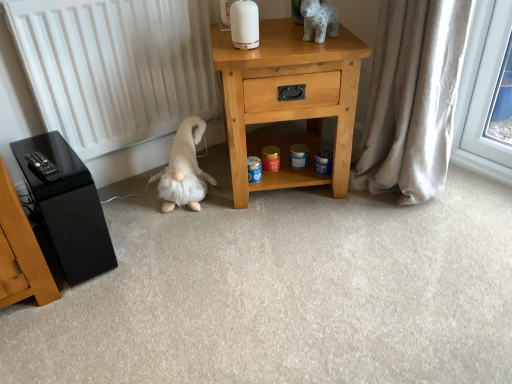
Question: Is beige fabric curtain at right positioned with its back to light wood nightstand at center?

Choices:
 (A) no
 (B) yes

Answer: (A)

Question: From a real-world perspective, is beige fabric curtain at right on top of light wood nightstand at center?

Choices:
 (A) yes
 (B) no

Answer: (A)

Question: Is the depth of beige fabric curtain at right less than that of light wood nightstand at center?

Choices:
 (A) yes
 (B) no

Answer: (A)

Question: Is beige fabric curtain at right wider than light wood nightstand at center?

Choices:
 (A) yes
 (B) no

Answer: (B)

Question: Would you say beige fabric curtain at right is a long distance from light wood nightstand at center?

Choices:
 (A) no
 (B) yes

Answer: (A)

Question: Is point (219, 44) closer or farther from the camera than point (309, 3)?

Choices:
 (A) closer
 (B) farther

Answer: (B)

Question: Do you think light wood nightstand at center is within white glossy ceramic dog at upper center, which appears as the 1th animal when viewed from the top, or outside of it?

Choices:
 (A) outside
 (B) inside

Answer: (A)

Question: In terms of height, does light wood nightstand at center look taller or shorter compared to white glossy ceramic dog at upper center, the 2th animal when ordered from bottom to top?

Choices:
 (A) short
 (B) tall

Answer: (B)

Question: Considering their positions, is light wood nightstand at center located in front of or behind white glossy ceramic dog at upper center, the 2th animal when ordered from bottom to top?

Choices:
 (A) front
 (B) behind

Answer: (B)

Question: Is point click(64, 223) closer or farther from the camera than point click(150, 61)?

Choices:
 (A) closer
 (B) farther

Answer: (A)

Question: From the image's perspective, is black glossy speaker at left located above or below white matte radiator at left?

Choices:
 (A) below
 (B) above

Answer: (A)

Question: Considering the positions of black glossy speaker at left and white matte radiator at left in the image, is black glossy speaker at left taller or shorter than white matte radiator at left?

Choices:
 (A) tall
 (B) short

Answer: (B)

Question: From a real-world perspective, relative to white matte radiator at left, is black glossy speaker at left vertically above or below?

Choices:
 (A) below
 (B) above

Answer: (A)

Question: From the image's perspective, is beige fabric curtain at right above or below black glossy speaker at left?

Choices:
 (A) below
 (B) above

Answer: (B)

Question: Is point (399, 120) closer or farther from the camera than point (66, 188)?

Choices:
 (A) closer
 (B) farther

Answer: (B)